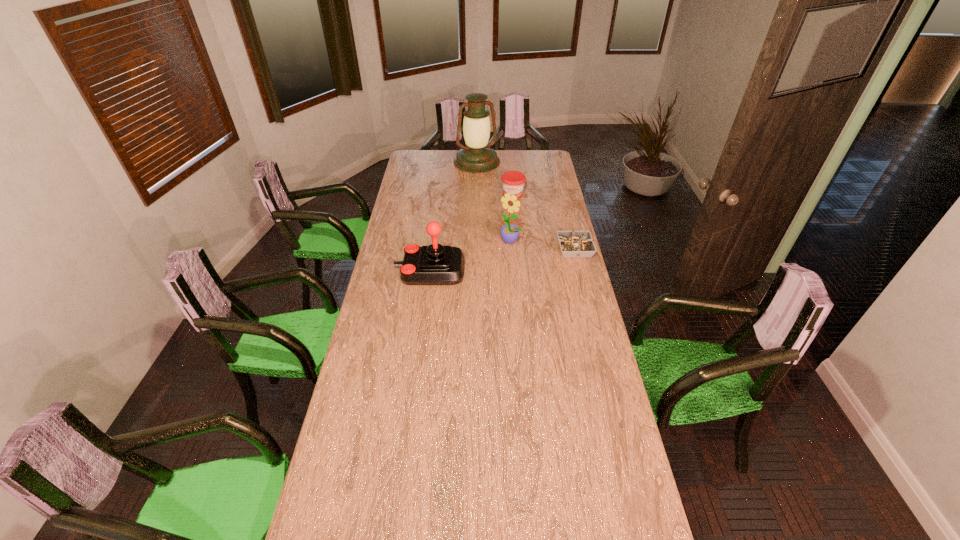
Locate an element on the screen. joystick is located at coordinates (435, 264).

Find the location of a particular element. the rightmost object is located at coordinates (578, 244).

You are a GUI agent. You are given a task and a screenshot of the screen. Output one action in this format:
    pyautogui.click(x=<x>, y=<y>)
    Task: Click on the ashtray
    Image resolution: width=960 pixels, height=540 pixels.
    Given the screenshot: What is the action you would take?
    pyautogui.click(x=578, y=244)

The image size is (960, 540). Identify the location of the farthest object. (476, 157).

Find the location of `lantern`. lantern is located at coordinates (476, 157).

Identify the location of sunflower. (509, 233).

Locate an element on the screen. This screenshot has height=540, width=960. the fourth nearest object is located at coordinates (513, 182).

At what (x,y) coordinates should I click in order to perform the action: click on the fourth tallest object. Please return your answer as a coordinate pair (x, y). Looking at the image, I should click on (513, 182).

Find the location of `vacant region located 0.050m on the base of the joystick`. vacant region located 0.050m on the base of the joystick is located at coordinates (384, 271).

At what (x,y) coordinates should I click in order to perform the action: click on vacant point located on the base of the joystick. Please return your answer as a coordinate pair (x, y). The image size is (960, 540). Looking at the image, I should click on [380, 271].